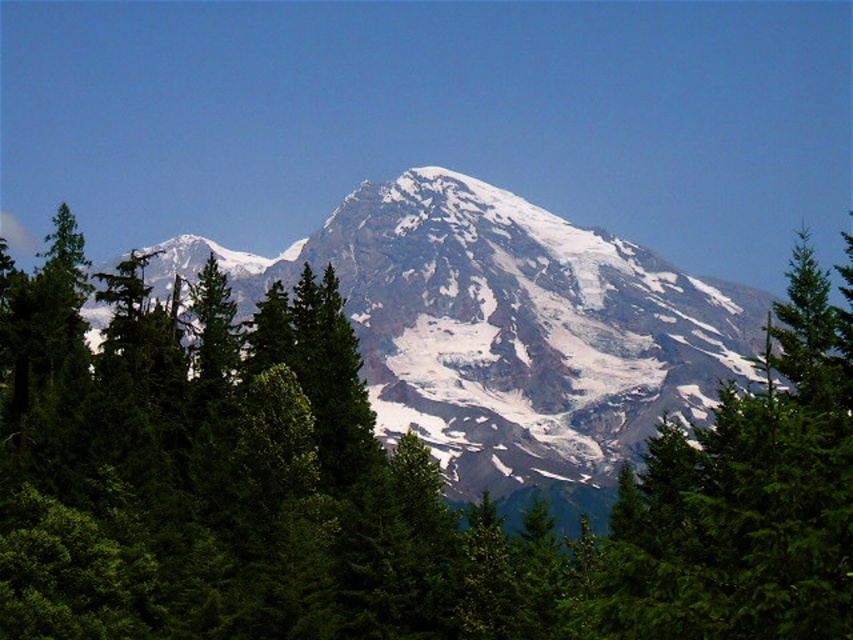
Between white snow-covered mountain at center and green evergreen tree at center, which one is positioned higher?

white snow-covered mountain at center is above.

What do you see at coordinates (508, 330) in the screenshot? I see `white snow-covered mountain at center` at bounding box center [508, 330].

The width and height of the screenshot is (853, 640). In order to click on white snow-covered mountain at center in this screenshot , I will do `click(508, 330)`.